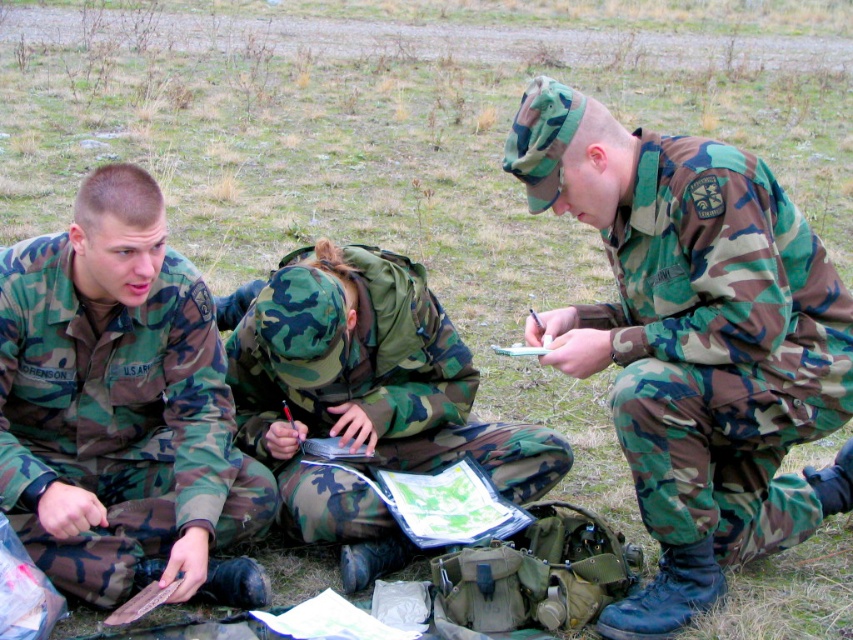
Who is more distant from viewer, (x=642, y=483) or (x=354, y=388)?

Point (x=354, y=388)

Between camouflage fabric uniform at center and camo fabric uniform at center, which one is positioned lower?

Positioned lower is camo fabric uniform at center.

Locate an element on the screen. This screenshot has width=853, height=640. camouflage fabric uniform at center is located at coordinates (694, 340).

Is camouflage fabric uniform at center positioned before camouflage uniform at left?

Yes, camouflage fabric uniform at center is closer to the viewer.

At what (x,y) coordinates should I click in order to perform the action: click on camouflage fabric uniform at center. Please return your answer as a coordinate pair (x, y). Looking at the image, I should click on (694, 340).

Measure the distance between point [581,211] and camera.

The distance of point [581,211] from camera is 2.70 meters.

Find the location of a particular element. This screenshot has height=640, width=853. camouflage fabric uniform at center is located at coordinates (694, 340).

Who is more forward, (99,344) or (372,429)?

Point (99,344)

Who is more forward, (123, 269) or (404, 444)?

Point (123, 269) is in front.

At what (x,y) coordinates should I click in order to perform the action: click on camouflage uniform at left. Please return your answer as a coordinate pair (x, y). The image size is (853, 640). Looking at the image, I should click on (123, 406).